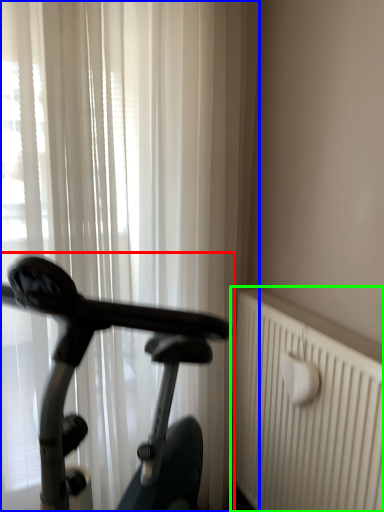
Question: Estimate the real-world distances between objects in this image. Which object is farther from bicycle (highlighted by a red box), curtain (highlighted by a blue box) or radiator (highlighted by a green box)?

Choices:
 (A) curtain
 (B) radiator

Answer: (A)